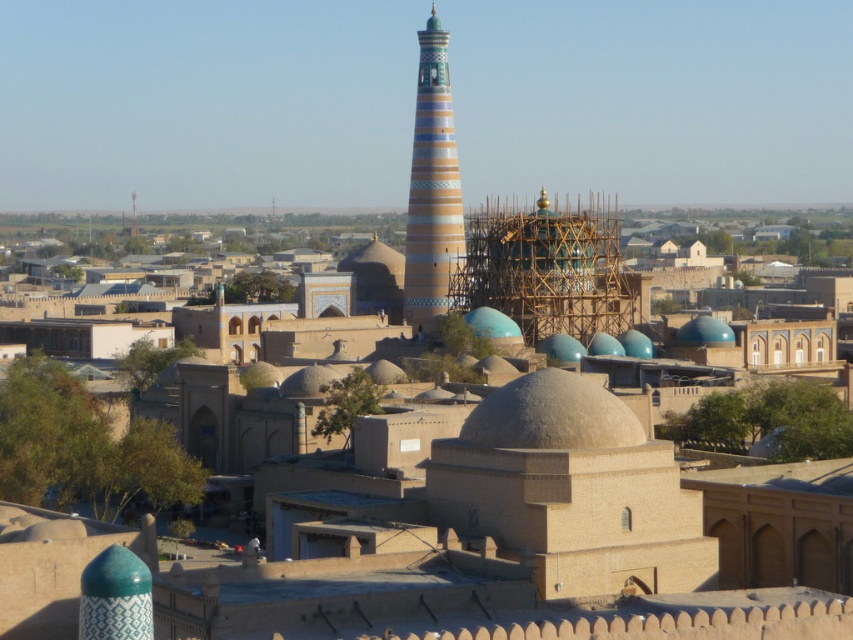
Is multicolored glazed tower at center to the left of gray textured dome at center from the viewer's perspective?

Correct, you'll find multicolored glazed tower at center to the left of gray textured dome at center.

Does multicolored glazed tower at center have a lesser width compared to gray textured dome at center?

Yes, multicolored glazed tower at center is thinner than gray textured dome at center.

Describe the element at coordinates (432, 188) in the screenshot. I see `multicolored glazed tower at center` at that location.

This screenshot has height=640, width=853. In order to click on multicolored glazed tower at center in this screenshot , I will do `click(432, 188)`.